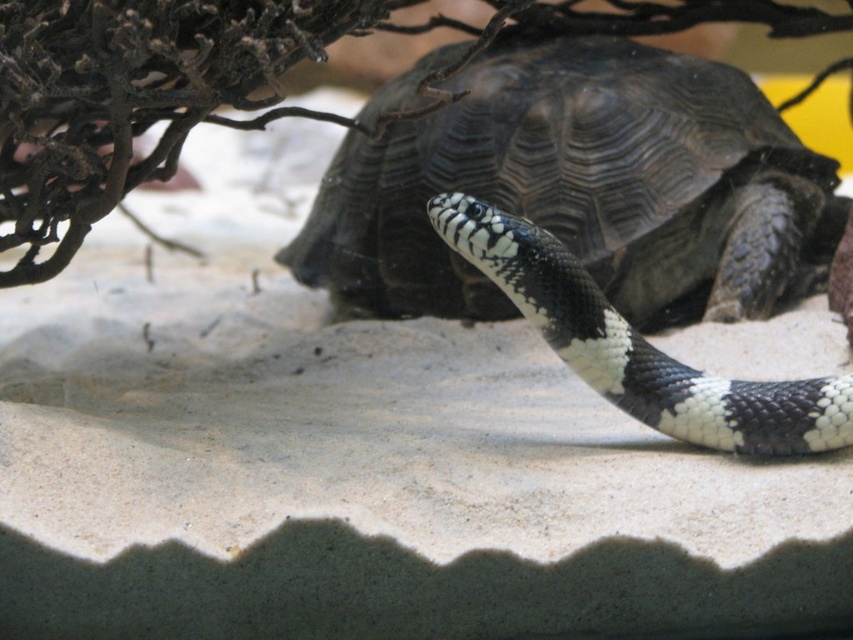
Question: Is shiny black tortoise at center smaller than black and white scales at center?

Choices:
 (A) no
 (B) yes

Answer: (A)

Question: Can you confirm if shiny black tortoise at center is positioned below black and white scales at center?

Choices:
 (A) no
 (B) yes

Answer: (A)

Question: Which of the following is the farthest from the observer?

Choices:
 (A) (358, 221)
 (B) (613, 353)

Answer: (A)

Question: Can you confirm if shiny black tortoise at center is positioned to the right of black and white scales at center?

Choices:
 (A) no
 (B) yes

Answer: (A)